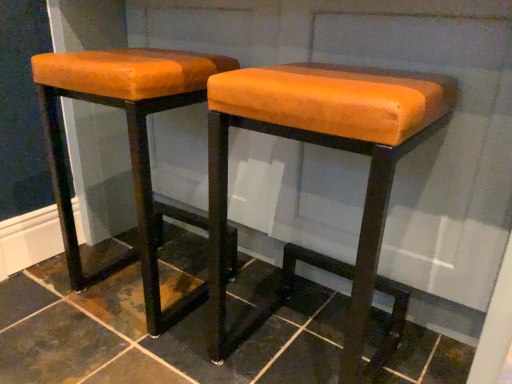
Question: Is dark brown tile at center located within orange leather stool at center, positioned as the 2th stool in left-to-right order?

Choices:
 (A) no
 (B) yes

Answer: (A)

Question: Can you confirm if orange leather stool at center, the first stool in the right-to-left sequence, is taller than dark brown tile at center?

Choices:
 (A) no
 (B) yes

Answer: (B)

Question: Can you confirm if orange leather stool at center, positioned as the 2th stool in left-to-right order, is wider than dark brown tile at center?

Choices:
 (A) no
 (B) yes

Answer: (A)

Question: Is orange leather stool at center, the first stool in the right-to-left sequence, placed right next to dark brown tile at center?

Choices:
 (A) yes
 (B) no

Answer: (B)

Question: Is orange leather stool at center, positioned as the 2th stool in left-to-right order, outside of dark brown tile at center?

Choices:
 (A) yes
 (B) no

Answer: (A)

Question: Is dark brown tile at center taller or shorter than orange leather stool at center, positioned as the 2th stool in left-to-right order?

Choices:
 (A) short
 (B) tall

Answer: (A)

Question: Considering the positions of dark brown tile at center and orange leather stool at center, positioned as the 2th stool in left-to-right order, in the image, is dark brown tile at center wider or thinner than orange leather stool at center, positioned as the 2th stool in left-to-right order,?

Choices:
 (A) thin
 (B) wide

Answer: (B)

Question: Relative to orange leather stool at center, the first stool in the right-to-left sequence, is dark brown tile at center in front or behind?

Choices:
 (A) front
 (B) behind

Answer: (A)

Question: Is point (136, 276) closer or farther from the camera than point (212, 249)?

Choices:
 (A) farther
 (B) closer

Answer: (A)

Question: Considering the relative positions of orange leather stool at left, placed as the second stool when sorted from right to left, and orange leather stool at center, the first stool in the right-to-left sequence, in the image provided, is orange leather stool at left, placed as the second stool when sorted from right to left, to the left or to the right of orange leather stool at center, the first stool in the right-to-left sequence,?

Choices:
 (A) left
 (B) right

Answer: (A)

Question: Which is correct: orange leather stool at left, placed as the second stool when sorted from right to left, is inside orange leather stool at center, positioned as the 2th stool in left-to-right order, or outside of it?

Choices:
 (A) outside
 (B) inside

Answer: (A)

Question: Relative to orange leather stool at center, positioned as the 2th stool in left-to-right order, is orange leather stool at left, which is counted as the first stool, starting from the left, in front or behind?

Choices:
 (A) behind
 (B) front

Answer: (A)

Question: From a real-world perspective, relative to orange leather stool at center, positioned as the 2th stool in left-to-right order, is orange leather stool at left, which is counted as the first stool, starting from the left, vertically above or below?

Choices:
 (A) above
 (B) below

Answer: (B)

Question: From a real-world perspective, is dark brown tile at center positioned above or below orange leather stool at left, placed as the second stool when sorted from right to left?

Choices:
 (A) below
 (B) above

Answer: (A)

Question: Is dark brown tile at center wider or thinner than orange leather stool at left, placed as the second stool when sorted from right to left?

Choices:
 (A) thin
 (B) wide

Answer: (B)